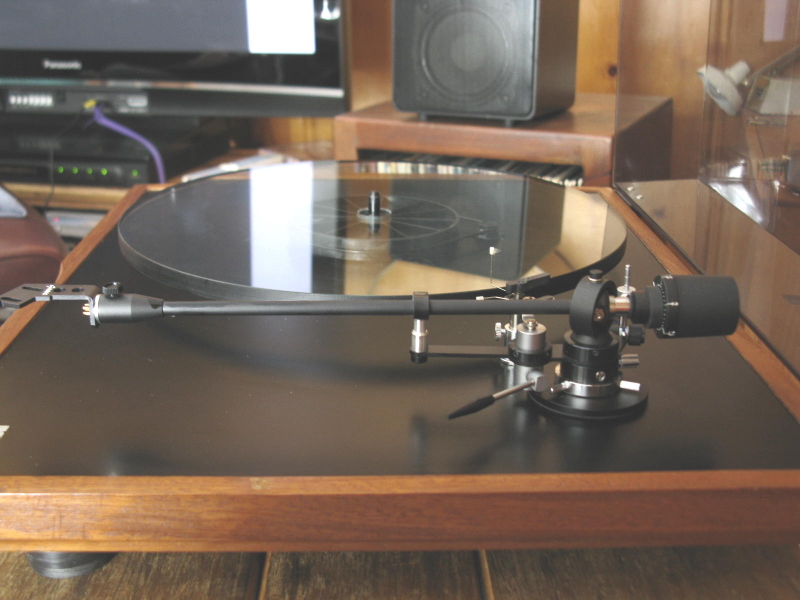
Where is `screen`? The width and height of the screenshot is (800, 600). screen is located at coordinates (70, 34).